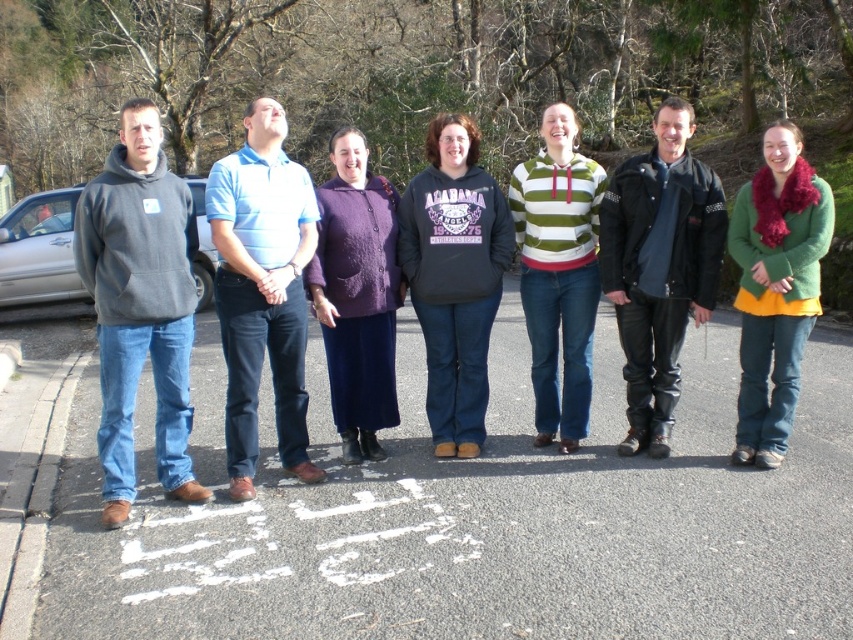
Question: Estimate the real-world distances between objects in this image. Which object is farther from the striped knitwear at center?

Choices:
 (A) purple knitted sweater at center
 (B) blue striped polo shirt at center

Answer: (B)

Question: Among these objects, which one is nearest to the camera?

Choices:
 (A) purple knitted sweater at center
 (B) green fuzzy scarf at right
 (C) striped knitwear at center
 (D) blue striped polo shirt at center

Answer: (D)

Question: Is blue striped polo shirt at center further to the viewer compared to striped knitwear at center?

Choices:
 (A) yes
 (B) no

Answer: (B)

Question: Which point is farther to the camera?

Choices:
 (A) (485, 188)
 (B) (161, 384)

Answer: (A)

Question: Can you confirm if green fuzzy scarf at right is positioned above purple knitted sweater at center?

Choices:
 (A) yes
 (B) no

Answer: (B)

Question: Does matte gray hoodie at left appear under gray matte hoodie at left?

Choices:
 (A) yes
 (B) no

Answer: (B)